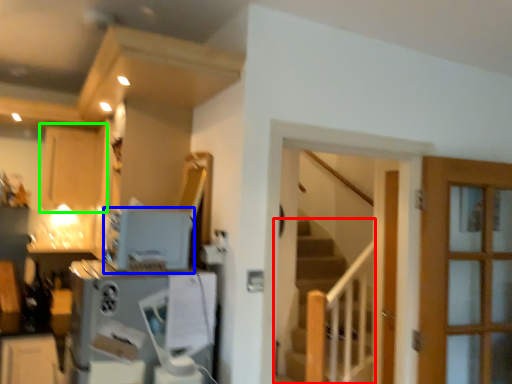
Question: Considering the real-world distances, which object is closest to stairs (highlighted by a red box)? appliance (highlighted by a blue box) or cabinetry (highlighted by a green box).

Choices:
 (A) appliance
 (B) cabinetry

Answer: (B)